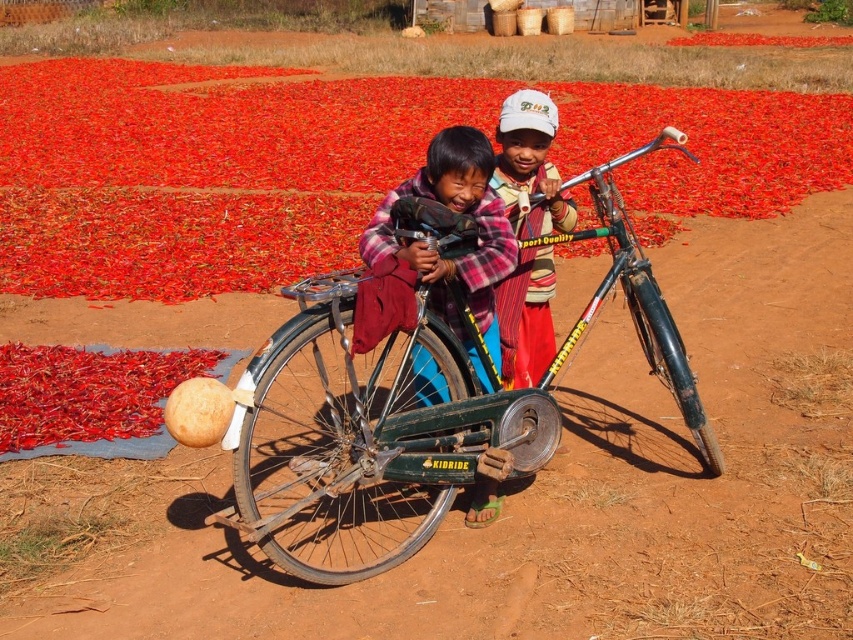
From the picture: Who is more distant from viewer, (351,413) or (483,312)?

Positioned behind is point (483,312).

Identify the location of green matte bicycle at center. (422, 410).

Is green matte bicycle at center thinner than striped fabric shirt at center?

Incorrect, green matte bicycle at center's width is not less than striped fabric shirt at center's.

Is point (410, 385) behind point (509, 99)?

Yes, point (410, 385) is farther from viewer.

The width and height of the screenshot is (853, 640). Find the location of `green matte bicycle at center`. green matte bicycle at center is located at coordinates (422, 410).

Can you confirm if plaid fabric shirt at center is taller than striped fabric shirt at center?

No.

Does point (434, 372) come closer to viewer compared to point (503, 380)?

Yes, point (434, 372) is closer to viewer.

Which is in front, point (373, 276) or point (552, 330)?

Positioned in front is point (373, 276).

The image size is (853, 640). I want to click on plaid fabric shirt at center, so click(x=436, y=250).